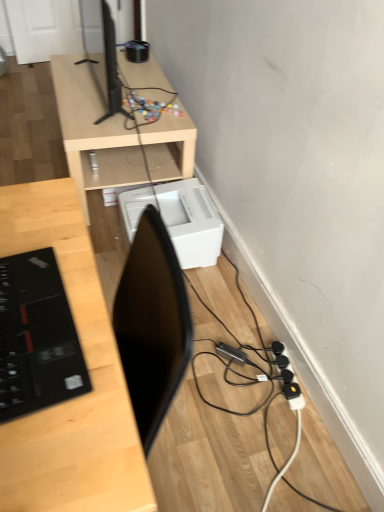
This screenshot has width=384, height=512. What do you see at coordinates (111, 66) in the screenshot?
I see `black glossy tv at upper left` at bounding box center [111, 66].

In order to face black glossy laptop at left, should I rotate leftwards or rightwards?

You should look left and rotate roughly 22.537 degrees.

Locate an element on the screen. The height and width of the screenshot is (512, 384). white plastic printer at lower center is located at coordinates (191, 222).

Image resolution: width=384 pixels, height=512 pixels. What do you see at coordinates (89, 374) in the screenshot?
I see `light wood desk at center, the second desk in the top-to-bottom sequence` at bounding box center [89, 374].

Locate an element on the screen. black glossy tv at upper left is located at coordinates (111, 66).

Is black glossy laptop at left at the left side of white plastic printer at lower center?

Indeed, black glossy laptop at left is positioned on the left side of white plastic printer at lower center.

Considering the points (28, 347) and (203, 189), which point is behind, point (28, 347) or point (203, 189)?

The point (203, 189) is farther from the camera.

Would you say white plastic printer at lower center is part of black glossy laptop at left's contents?

No, white plastic printer at lower center is located outside of black glossy laptop at left.

Does black glossy tv at upper left come behind white plastic printer at lower center?

No, it is in front of white plastic printer at lower center.

Considering the sizes of objects black glossy tv at upper left and white plastic printer at lower center in the image provided, who is bigger, black glossy tv at upper left or white plastic printer at lower center?

black glossy tv at upper left is bigger.

From the image's perspective, which object appears higher, black glossy tv at upper left or white plastic printer at lower center?

black glossy tv at upper left appears higher in the image.

Could you tell me if black glossy tv at upper left is facing white plastic printer at lower center?

No, black glossy tv at upper left is not aimed at white plastic printer at lower center.

From the picture: How different are the orientations of black glossy laptop at left and black glossy tv at upper left in degrees?

The facing directions of black glossy laptop at left and black glossy tv at upper left are 176 degrees apart.

Is black glossy laptop at left wider or thinner than black glossy tv at upper left?

Considering their sizes, black glossy laptop at left looks slimmer than black glossy tv at upper left.

Is black glossy laptop at left next to black glossy tv at upper left and touching it?

No.

Is light wood/finished desk at upper center, which appears as the 2th desk when ordered from the bottom, wider than black glossy laptop at left?

Indeed, light wood/finished desk at upper center, which appears as the 2th desk when ordered from the bottom, has a greater width compared to black glossy laptop at left.

Considering the positions of objects light wood/finished desk at upper center, the 1th desk from the top, and black glossy laptop at left in the image provided, who is more to the right, light wood/finished desk at upper center, the 1th desk from the top, or black glossy laptop at left?

black glossy laptop at left is more to the right.

Considering the sizes of objects light wood/finished desk at upper center, marked as the first desk in a back-to-front arrangement, and black glossy laptop at left in the image provided, who is smaller, light wood/finished desk at upper center, marked as the first desk in a back-to-front arrangement, or black glossy laptop at left?

black glossy laptop at left.

From a real-world perspective, is light wood/finished desk at upper center, which appears as the 2th desk when ordered from the bottom, physically located above or below black glossy laptop at left?

In terms of real-world spatial position, light wood/finished desk at upper center, which appears as the 2th desk when ordered from the bottom, is below black glossy laptop at left.

Can you confirm if white plastic printer at lower center is taller than black plastic extension cord at lower right?

Correct, white plastic printer at lower center is much taller as black plastic extension cord at lower right.

Are white plastic printer at lower center and black plastic extension cord at lower right far apart?

That's not correct — white plastic printer at lower center is a little close to black plastic extension cord at lower right.

Considering the relative positions of white plastic printer at lower center and black plastic extension cord at lower right in the image provided, is white plastic printer at lower center to the left or to the right of black plastic extension cord at lower right?

Clearly, white plastic printer at lower center is on the left of black plastic extension cord at lower right in the image.

Is white plastic printer at lower center positioned behind black plastic extension cord at lower right?

Yes, it is.

Are light wood/finished desk at upper center, marked as the first desk in a back-to-front arrangement, and black glossy tv at upper left located far from each other?

light wood/finished desk at upper center, marked as the first desk in a back-to-front arrangement, is actually quite close to black glossy tv at upper left.

Considering the relative positions of light wood/finished desk at upper center, which appears as the 2th desk when ordered from the bottom, and black glossy tv at upper left in the image provided, is light wood/finished desk at upper center, which appears as the 2th desk when ordered from the bottom, to the left of black glossy tv at upper left from the viewer's perspective?

No, light wood/finished desk at upper center, which appears as the 2th desk when ordered from the bottom, is not to the left of black glossy tv at upper left.

Does light wood/finished desk at upper center, marked as the first desk in a back-to-front arrangement, turn towards black glossy tv at upper left?

No, light wood/finished desk at upper center, marked as the first desk in a back-to-front arrangement, is not aimed at black glossy tv at upper left.

Is white plastic printer at lower center to the left or to the right of light wood desk at center, the second desk in the top-to-bottom sequence, in the image?

Clearly, white plastic printer at lower center is on the right of light wood desk at center, the second desk in the top-to-bottom sequence, in the image.

Which object is closer to the camera taking this photo, white plastic printer at lower center or light wood desk at center, arranged as the 1th desk when viewed from the front?

light wood desk at center, arranged as the 1th desk when viewed from the front.

How far apart are white plastic printer at lower center and light wood desk at center, which is the second desk in back-to-front order?

They are 36.18 inches apart.

Looking at the image, does white plastic printer at lower center seem bigger or smaller compared to light wood desk at center, which is the first desk from bottom to top?

Considering their sizes, white plastic printer at lower center takes up less space than light wood desk at center, which is the first desk from bottom to top.

Locate an element on the screen. This screenshot has height=512, width=384. printer lying above the black glossy laptop at left (from the image's perspective) is located at coordinates (191, 222).

This screenshot has width=384, height=512. In order to click on television that is above the white plastic printer at lower center (from a real-world perspective) in this screenshot , I will do `click(111, 66)`.

Based on their spatial positions, is white plastic printer at lower center or light wood/finished desk at upper center, the 1th desk from the top, closer to black glossy laptop at left?

white plastic printer at lower center.

Considering their positions, is black glossy laptop at left positioned further to black glossy tv at upper left than white plastic printer at lower center?

black glossy laptop at left lies further to black glossy tv at upper left than the other object.

Estimate the real-world distances between objects in this image. Which object is further from white plastic printer at lower center, light wood/finished desk at upper center, positioned as the second desk in front-to-back order, or light wood desk at center, which is the second desk in back-to-front order?

Based on the image, light wood desk at center, which is the second desk in back-to-front order, appears to be further to white plastic printer at lower center.

Based on their spatial positions, is black glossy tv at upper left or white plastic printer at lower center further from light wood desk at center, arranged as the 1th desk when viewed from the front?

The object further to light wood desk at center, arranged as the 1th desk when viewed from the front, is black glossy tv at upper left.

Based on their spatial positions, is white plastic printer at lower center or light wood desk at center, arranged as the 1th desk when viewed from the front, further from black glossy laptop at left?

Based on the image, white plastic printer at lower center appears to be further to black glossy laptop at left.

Based on their spatial positions, is black plastic extension cord at lower right or white plastic printer at lower center further from light wood desk at center, arranged as the 1th desk when viewed from the front?

The object further to light wood desk at center, arranged as the 1th desk when viewed from the front, is black plastic extension cord at lower right.

Considering their positions, is white plastic printer at lower center positioned further to light wood/finished desk at upper center, the 1th desk from the top, than black glossy tv at upper left?

white plastic printer at lower center is further to light wood/finished desk at upper center, the 1th desk from the top.

When comparing their distances from black glossy laptop at left, does black plastic extension cord at lower right or white plastic printer at lower center seem further?

Among the two, white plastic printer at lower center is located further to black glossy laptop at left.

Where is `printer between light wood desk at center, the second desk in the top-to-bottom sequence, and light wood/finished desk at upper center, positioned as the second desk in front-to-back order, from front to back`? printer between light wood desk at center, the second desk in the top-to-bottom sequence, and light wood/finished desk at upper center, positioned as the second desk in front-to-back order, from front to back is located at coordinates (191, 222).

This screenshot has width=384, height=512. I want to click on printer that lies between black glossy tv at upper left and black plastic extension cord at lower right from top to bottom, so click(x=191, y=222).

Locate an element on the screen. Image resolution: width=384 pixels, height=512 pixels. laptop positioned between light wood desk at center, arranged as the 1th desk when viewed from the front, and light wood/finished desk at upper center, marked as the first desk in a back-to-front arrangement, from near to far is located at coordinates (37, 337).

I want to click on laptop that lies between black glossy tv at upper left and black plastic extension cord at lower right from top to bottom, so click(37, 337).